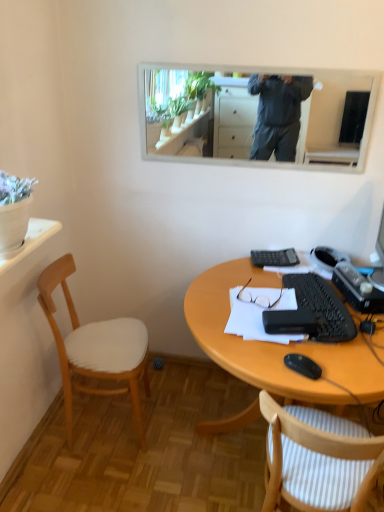
The height and width of the screenshot is (512, 384). I want to click on vacant area that is situated to the right of black plastic mouse at lower right, so 348,362.